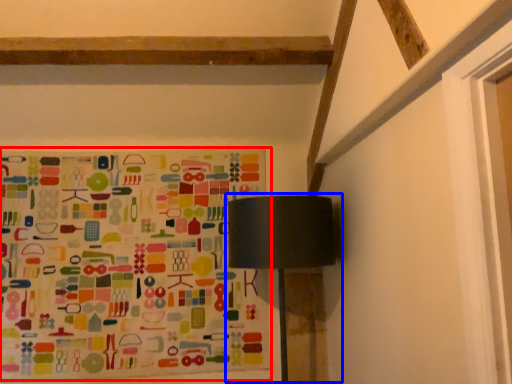
Question: Which of the following is the farthest to the observer, bulletin board (highlighted by a red box) or table lamp (highlighted by a blue box)?

Choices:
 (A) bulletin board
 (B) table lamp

Answer: (A)